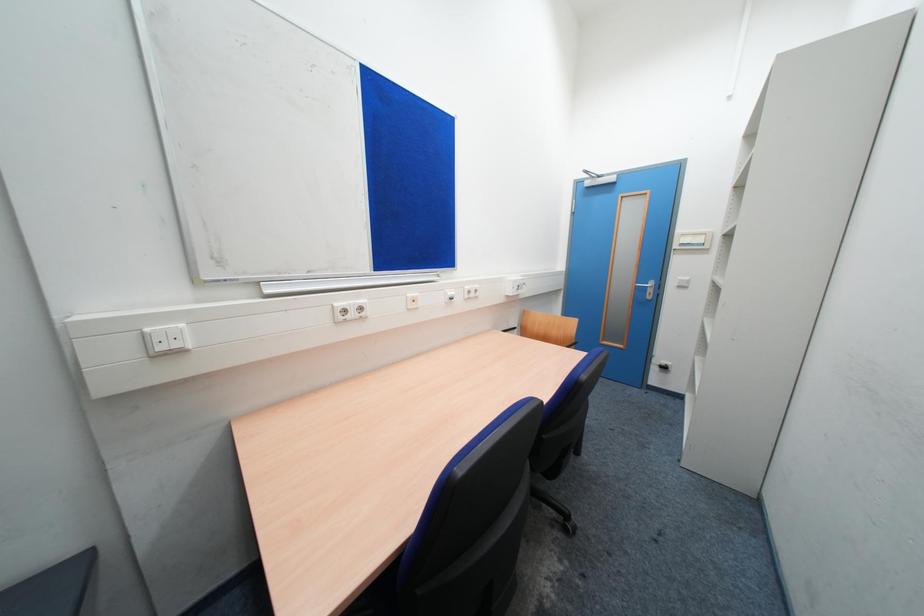
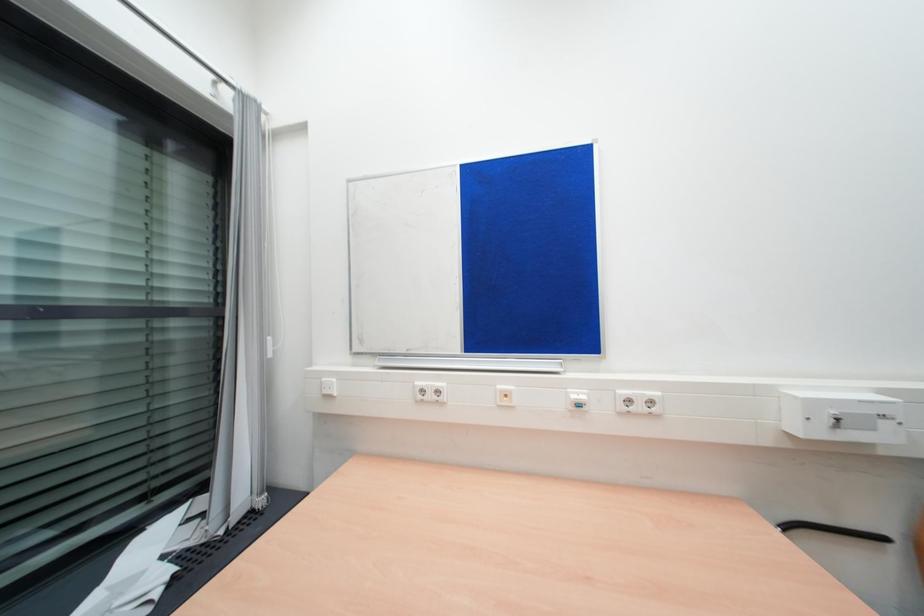
Question: How did the camera likely rotate?

Choices:
 (A) Left
 (B) Right
 (C) Up
 (D) Down

Answer: (A)